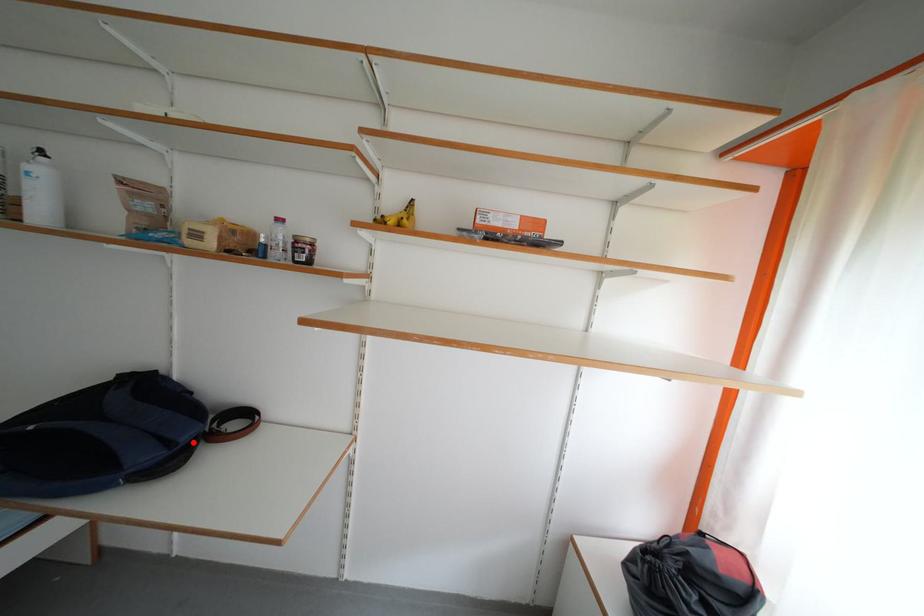
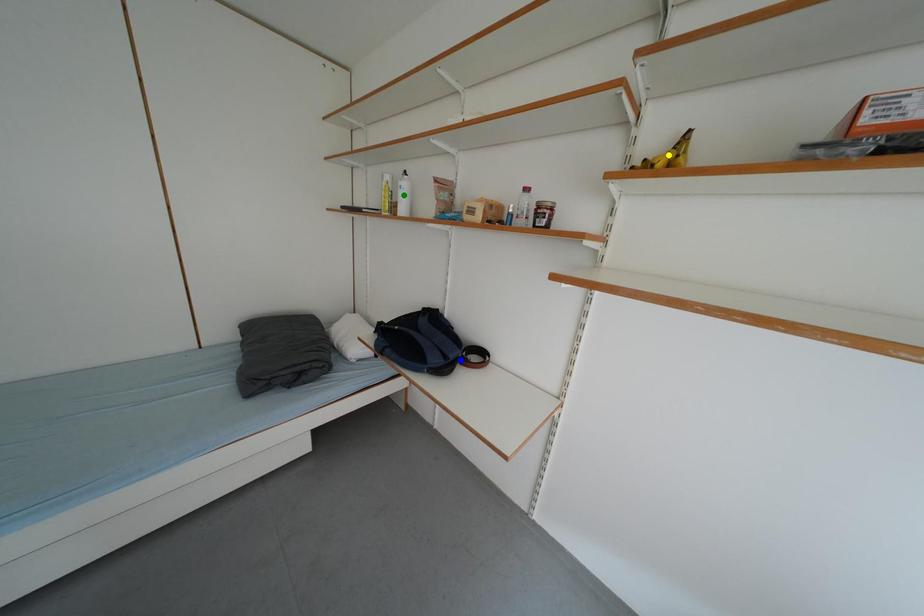
Question: I am providing you with two images of the same scene from different viewpoints. A red point is marked on the first image. You are given multiple points on the second image. Which point in image 2 represents the same 3d spot as the red point in image 1?

Choices:
 (A) blue point
 (B) yellow point
 (C) green point

Answer: (A)